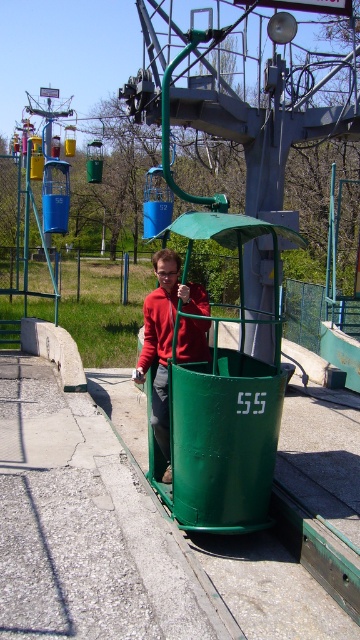
You are standing at the base of the chairlift and want to determine which of the two points, point (x=195, y=314) or point (x=183, y=346), is nearer to you. Based on the scene, which point is closer?

Point (x=195, y=314) is closer to the viewer than point (x=183, y=346).

Consider the image. You are a visitor at the amusement park and notice two red items in the lift car labeled 55. One is a matte red sweater at center and the other is a matte red jacket at center. Which one is positioned lower in the scene?

The matte red sweater at center is below the matte red jacket at center, so the sweater is positioned lower in the scene.